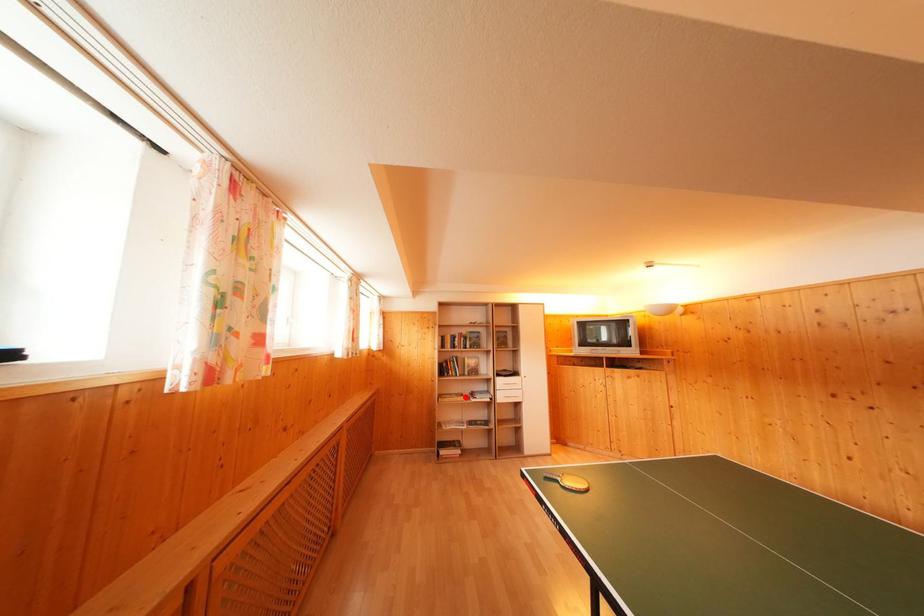
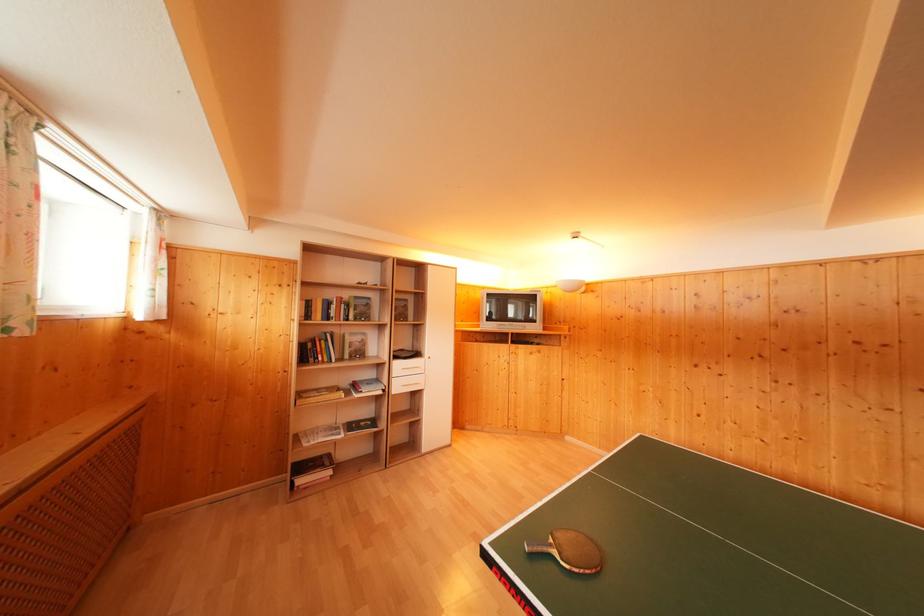
Question: I am providing you with two images of the same scene from different viewpoints. A red point is marked on the first image. At the location where the point appears in image 1, is it still visible in image 2?

Choices:
 (A) Yes
 (B) No

Answer: (A)